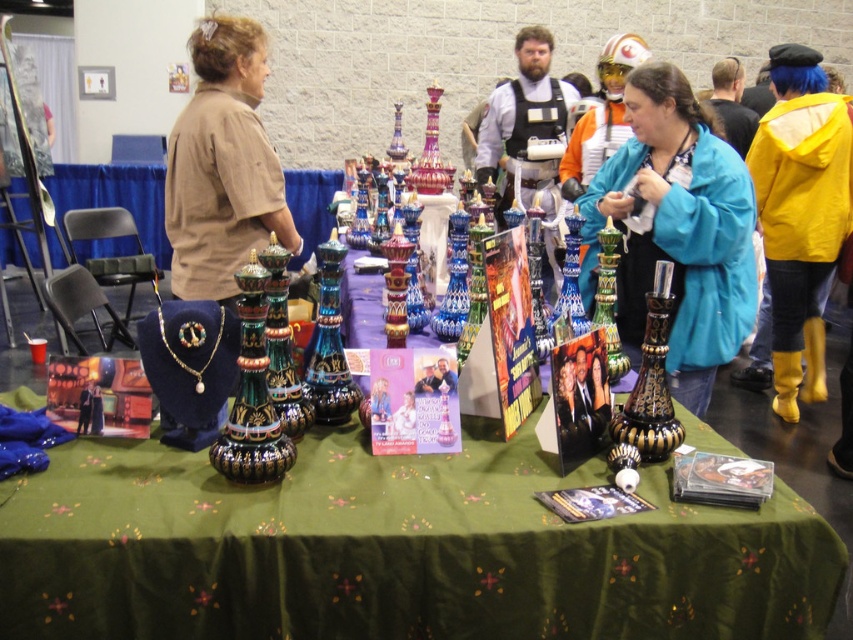
You are an event organizer who needs to place a new decorative item on the table. The new item is 10 cm tall. You want to ensure it doesn not block the view of the multicolored glass vase at center. Can you place it next to the teal matte jacket at center?

The multicolored glass vase at center has a lesser height compared to teal matte jacket at center. Since the new item is 10 cm tall and the vase is shorter than the jacket, placing the item next to the teal matte jacket at center might block the vase if the jacket is in front. Ensure the new item is placed behind or beside the jacket to maintain the vase visibility.

You are at the event and want to find the teal matte jacket at center. According to the spatial coordinates provided, where exactly is it positioned?

The teal matte jacket at center is located at point coordinates 0.358 on the x axis and 0.795 on the y axis.

You are standing at the entrance of the event and want to take a photo of the point at coordinates (682, 100). If your camera has a focal length of 50mm and you need to focus at a distance of 2.23 meters to capture that point clearly, what adjustment should you make to your camera settings?

The point at coordinates (682, 100) is 2.23 meters away from the viewer. To focus clearly, adjust the camera to focus at 2.23 meters.